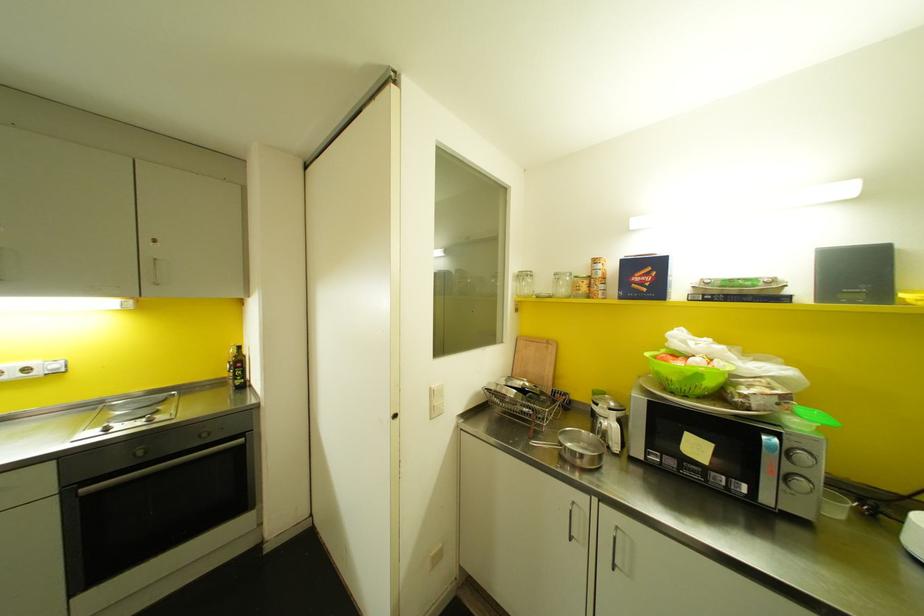
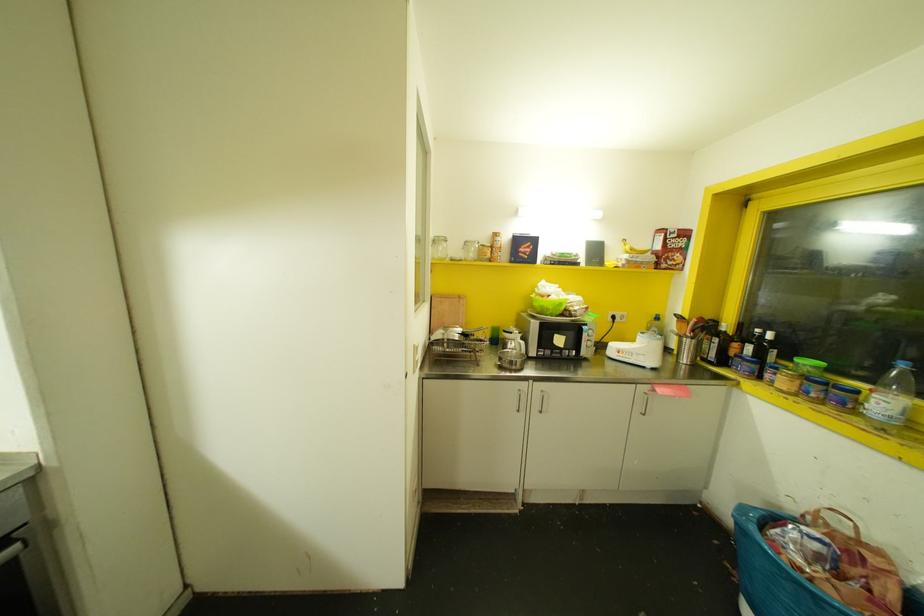
The point at (698, 376) is marked in the first image. Where is the corresponding point in the second image?

(560, 304)